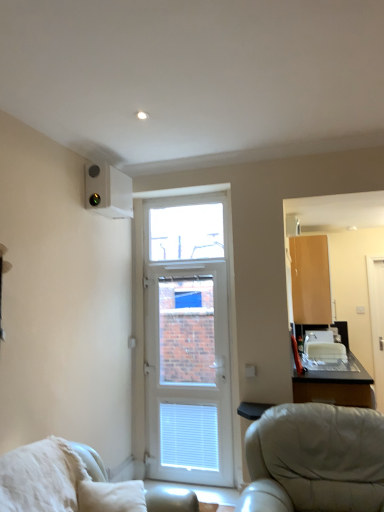
You are a GUI agent. You are given a task and a screenshot of the screen. Output one action in this format:
    pyautogui.click(x=<x>, y=<y>)
    Task: Click on the vacant point above white plastic door at center (from a real-world perspective)
    
    Given the screenshot: What is the action you would take?
    pyautogui.click(x=189, y=259)